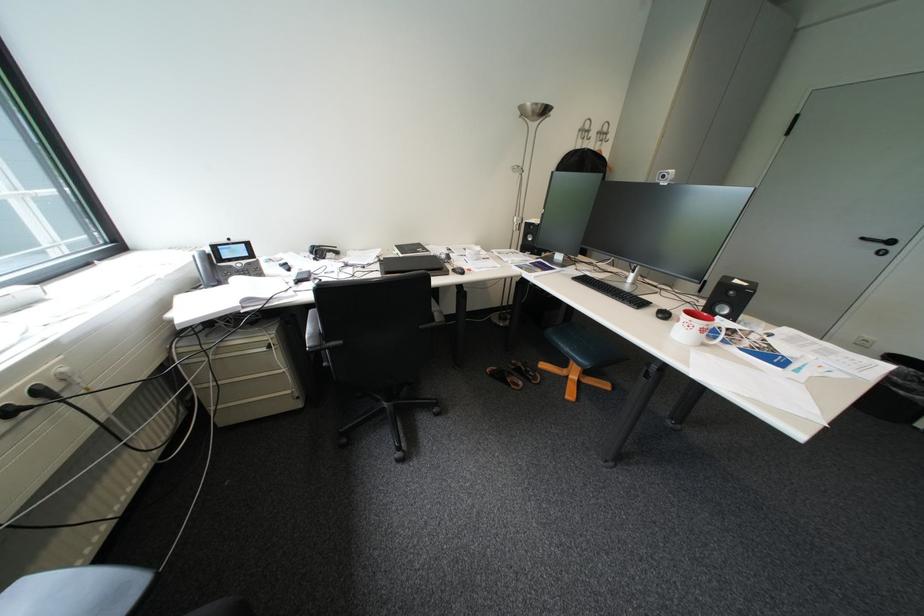
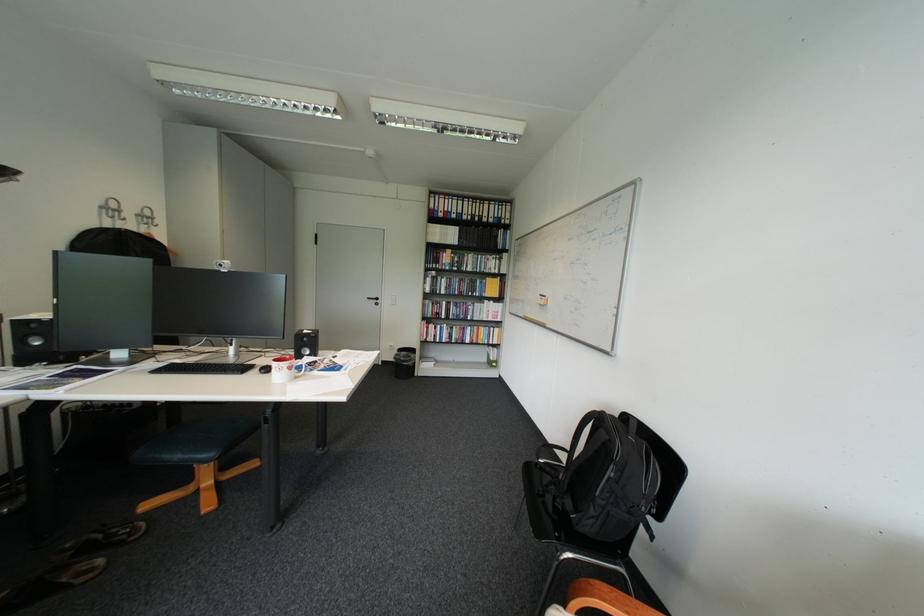
Locate, in the second image, the point that corresponds to [876,240] in the first image.

(381, 299)